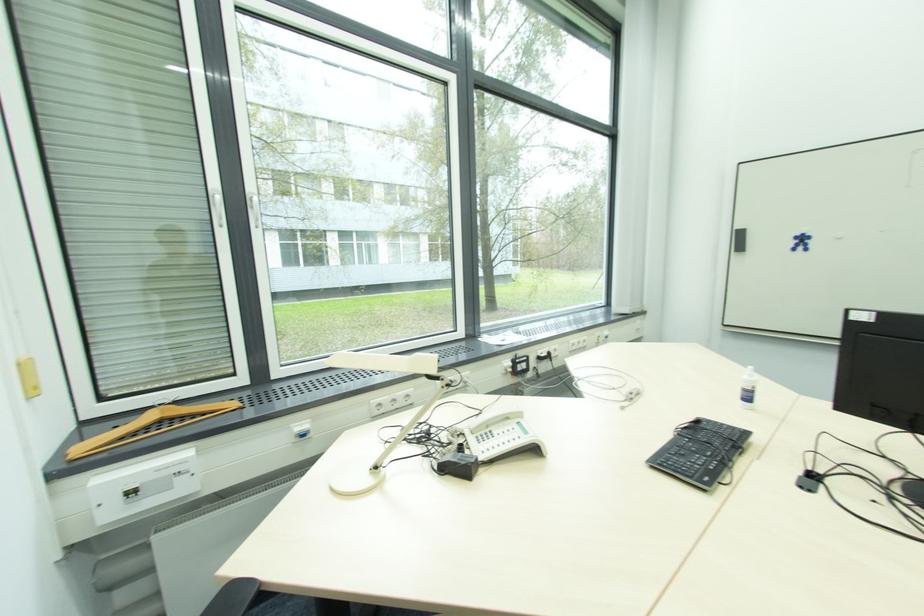
At what (x,y) coordinates should I click in order to perform the action: click on blue star magnet. Please return your answer as a coordinate pair (x, y). This screenshot has width=924, height=616. Looking at the image, I should click on (800, 241).